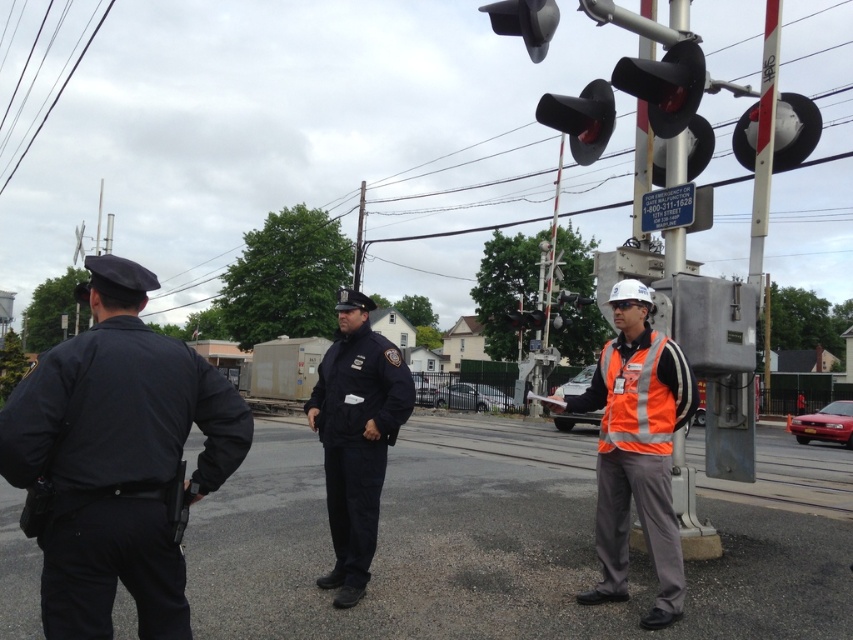
You are a pedestrian at the railroad crossing and notice both the red matte traffic light at upper right and the black rubber traffic light at upper center. Which one is closer to you?

The red matte traffic light at upper right is closer to you because it is in front of the black rubber traffic light at upper center.

In the scene shown: You are a pedestrian trying to cross the railroad tracks. There is a point marked at coordinates (117, 458). Which object is this point located on?

The point is located on the dark blue uniform at left.

You are a pedestrian at the railroad crossing and need to cross the street. You see the white glossy traffic light at upper right and the black rubber traffic light at upper center. Which traffic light is shorter?

The white glossy traffic light at upper right is shorter than the black rubber traffic light at upper center.